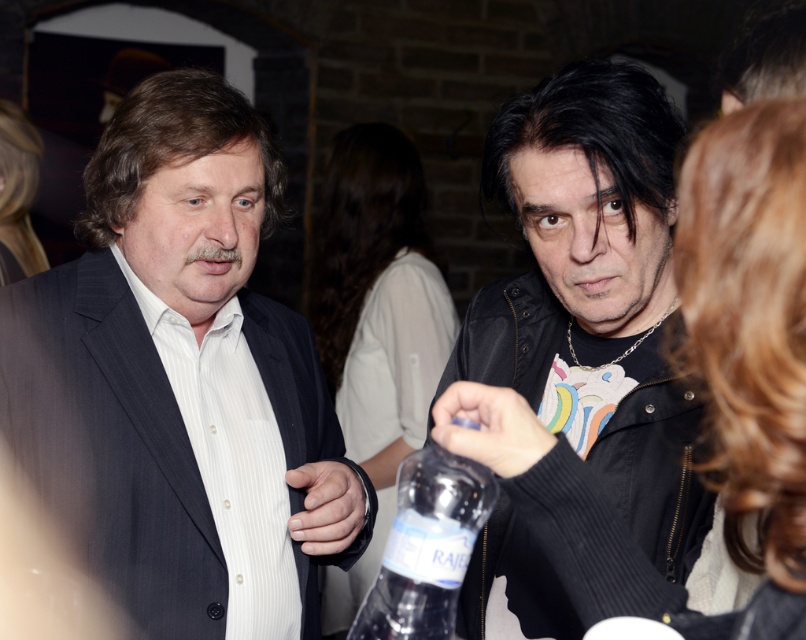
Who is lower down, matte black suit at left or clear plastic bottle at center?

clear plastic bottle at center is below.

Does matte black suit at left appear over clear plastic bottle at center?

Correct, matte black suit at left is located above clear plastic bottle at center.

Between point (279, 412) and point (487, 468), which one is positioned behind?

The point (279, 412) is behind.

Where is `matte black suit at left`? matte black suit at left is located at coordinates (181, 381).

Does black leather jacket at center have a greater width compared to clear plastic bottle at center?

→ Correct, the width of black leather jacket at center exceeds that of clear plastic bottle at center.

Which is in front, point (622, 497) or point (422, 577)?

Point (422, 577) is in front.

Where is `black leather jacket at center`? Image resolution: width=806 pixels, height=640 pixels. black leather jacket at center is located at coordinates (593, 294).

The image size is (806, 640). What do you see at coordinates (181, 381) in the screenshot?
I see `matte black suit at left` at bounding box center [181, 381].

Is point (306, 634) less distant than point (592, 196)?

No, it is behind (592, 196).

Describe the element at coordinates (181, 381) in the screenshot. I see `matte black suit at left` at that location.

The image size is (806, 640). In order to click on matte black suit at left in this screenshot , I will do `click(181, 381)`.